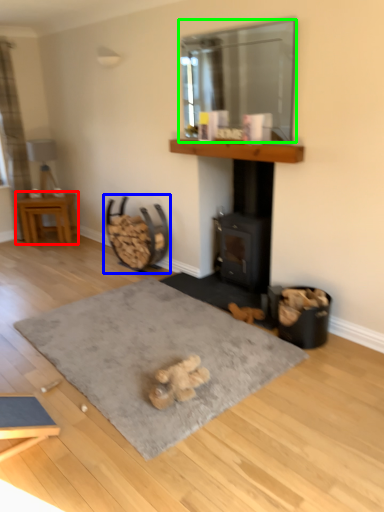
Question: Based on their relative distances, which object is farther from table (highlighted by a red box)? Choose from rocking chair (highlighted by a blue box) and window screen (highlighted by a green box).

Choices:
 (A) rocking chair
 (B) window screen

Answer: (B)